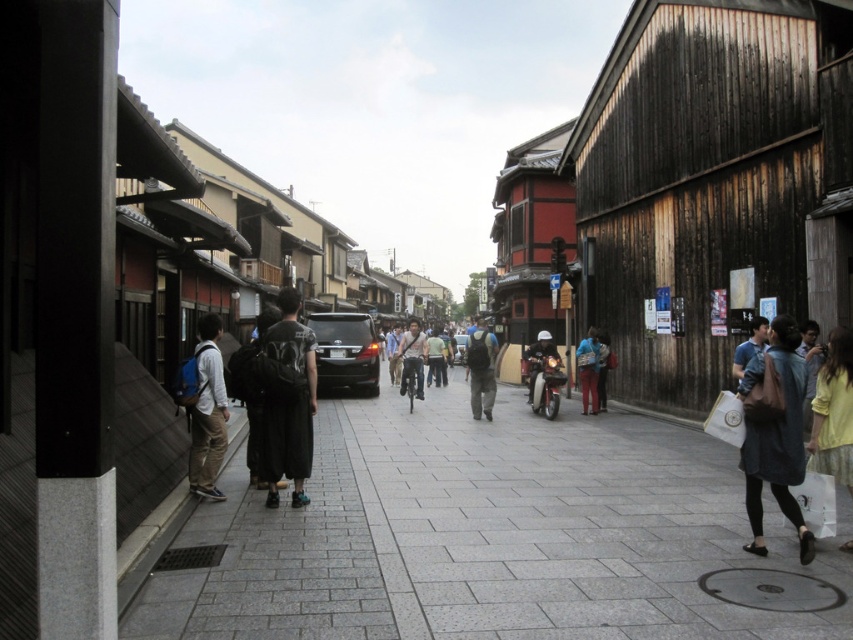
Can you confirm if gray concrete pavement at lower left is positioned below light blue denim jacket at center?

Yes.

Is gray concrete pavement at lower left to the left of light blue denim jacket at center from the viewer's perspective?

Incorrect, gray concrete pavement at lower left is not on the left side of light blue denim jacket at center.

The height and width of the screenshot is (640, 853). Describe the element at coordinates (485, 536) in the screenshot. I see `gray concrete pavement at lower left` at that location.

The width and height of the screenshot is (853, 640). In order to click on gray concrete pavement at lower left in this screenshot , I will do `click(485, 536)`.

Is matte gray backpack at center positioned behind light blue denim jacket at center?

No, matte gray backpack at center is closer to the viewer.

Based on the photo, is matte gray backpack at center above light blue denim jacket at center?

Yes.

The width and height of the screenshot is (853, 640). I want to click on matte gray backpack at center, so click(480, 369).

At what (x,y) coordinates should I click in order to perform the action: click on matte gray backpack at center. Please return your answer as a coordinate pair (x, y). Looking at the image, I should click on (480, 369).

From the picture: Who is positioned more to the left, matte gray backpack at center or matte black helmet at center?

From the viewer's perspective, matte gray backpack at center appears more on the left side.

Can you confirm if matte gray backpack at center is taller than matte black helmet at center?

Yes, matte gray backpack at center is taller than matte black helmet at center.

Which is behind, point (479, 412) or point (537, 348)?

The point (537, 348) is behind.

Find the location of `matte gray backpack at center`. matte gray backpack at center is located at coordinates (480, 369).